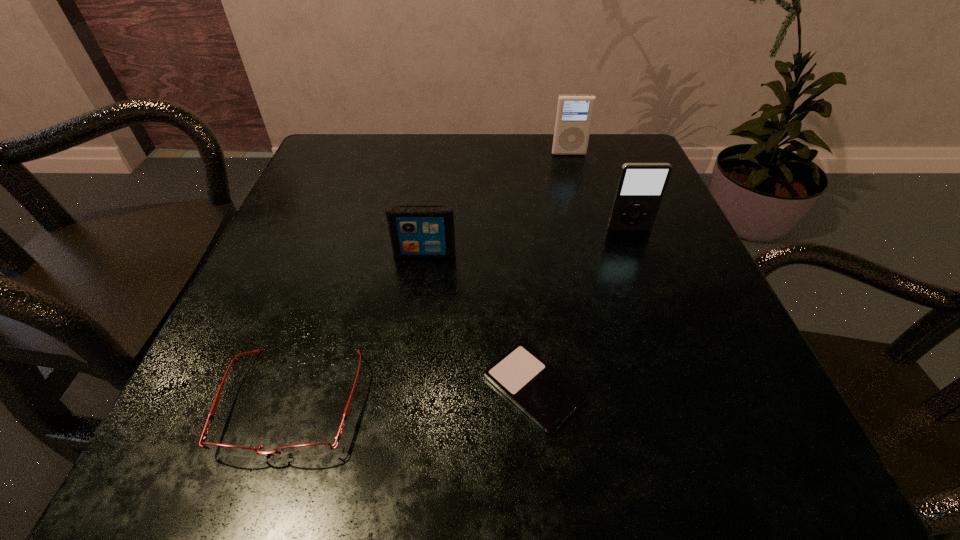
The height and width of the screenshot is (540, 960). In order to click on free space that is in between the leftmost object and the farthest object in this screenshot , I will do `click(431, 278)`.

Find the location of `free spot between the shortest object and the leftmost object`. free spot between the shortest object and the leftmost object is located at coordinates (413, 395).

The image size is (960, 540). I want to click on free space between the second farthest iPod and the second shortest object, so click(x=461, y=315).

At what (x,y) coordinates should I click in order to perform the action: click on free space between the third farthest object and the farthest iPod. Please return your answer as a coordinate pair (x, y). Looking at the image, I should click on (496, 204).

The width and height of the screenshot is (960, 540). Find the location of `the closest object to the leftmost object`. the closest object to the leftmost object is located at coordinates (544, 395).

This screenshot has height=540, width=960. What are the coordinates of `the closest object to the fourth nearest object` in the screenshot? It's located at 574,113.

Identify which iPod is located as the second nearest to the fourth nearest object. Please provide its 2D coordinates. Your answer should be formatted as a tuple, i.e. [(x, y)], where the tuple contains the x and y coordinates of a point satisfying the conditions above.

[(544, 395)]

Where is `iPod that is the third nearest to the third object from right to left`? The width and height of the screenshot is (960, 540). iPod that is the third nearest to the third object from right to left is located at coordinates (574, 113).

Where is `blank space that satisfies the following two spatial constraints: 1. on the front screen of the third nearest object; 2. on the left side of the shortest iPod`? Image resolution: width=960 pixels, height=540 pixels. blank space that satisfies the following two spatial constraints: 1. on the front screen of the third nearest object; 2. on the left side of the shortest iPod is located at coordinates (407, 388).

This screenshot has width=960, height=540. Identify the location of vacant position in the image that satisfies the following two spatial constraints: 1. on the front screen of the shortest iPod; 2. on the right side of the second nearest iPod. (407, 388).